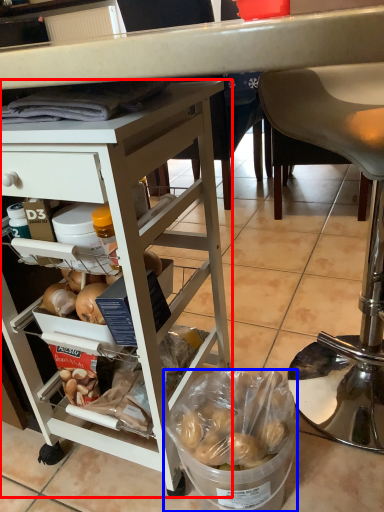
Question: Which object is further to the camera taking this photo, desk (highlighted by a red box) or bowl (highlighted by a blue box)?

Choices:
 (A) desk
 (B) bowl

Answer: (B)